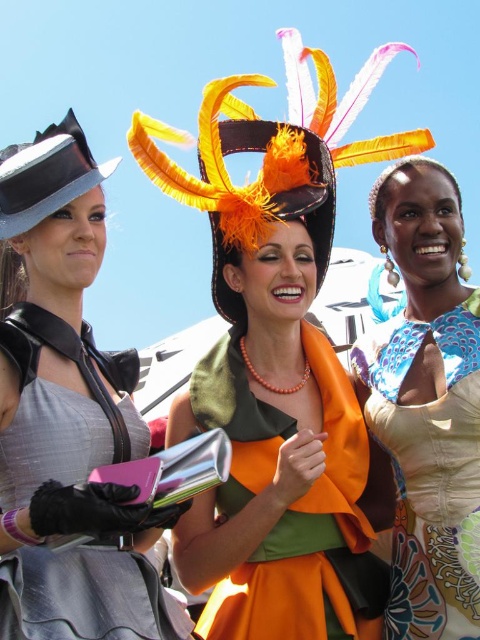
Who is positioned more to the right, matte black dress at left or matte black hat at left?

matte black dress at left is more to the right.

Is matte black dress at left further to the viewer compared to matte black hat at left?

No, matte black dress at left is in front of matte black hat at left.

Who is more distant from viewer, (148, 636) or (12, 236)?

Point (12, 236)

Locate an element on the screen. The height and width of the screenshot is (640, 480). matte black dress at left is located at coordinates (69, 417).

Is matte orange dress at center bigger than matte black hat at left?

Indeed, matte orange dress at center has a larger size compared to matte black hat at left.

Which is behind, point (471, 582) or point (75, 193)?

Point (75, 193)

Is point (455, 552) less distant than point (48, 147)?

That is True.

Where is `matte orange dress at center`? The image size is (480, 640). matte orange dress at center is located at coordinates (427, 404).

Is orange feathered hat at center thinner than matte black hat at left?

Incorrect, orange feathered hat at center's width is not less than matte black hat at left's.

Is point (407, 141) positioned in front of point (38, 145)?

No, (407, 141) is behind (38, 145).

Does point (364, 99) come in front of point (10, 198)?

No, (364, 99) is further to viewer.

Locate an element on the screen. The image size is (480, 640). orange feathered hat at center is located at coordinates coord(273,157).